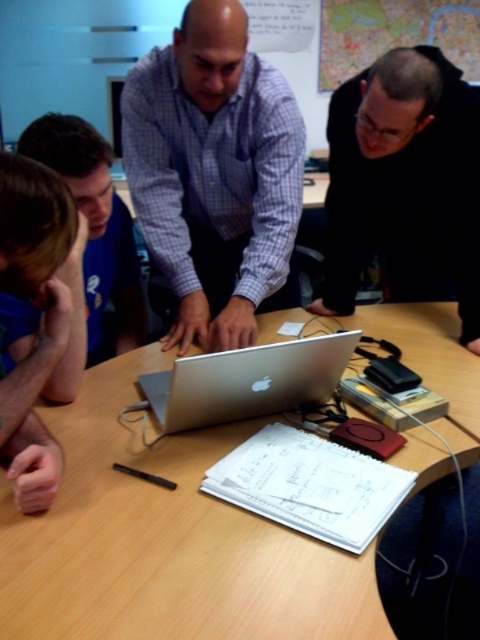
You are a person sitting at the wooden table at center. You want to reach for the black matte jacket at upper right. Is the jacket above or below the table?

The wooden table at center is below the black matte jacket at upper right, so the jacket is above the table.

You are standing in front of the table where the silver laptop is placed. There are two points marked on the table at coordinates point (152, 536) and point (195, 401). Which of these points is closer to you?

Point (152, 536) is closer to the camera than point (195, 401), so the point closer to you is point (152, 536).